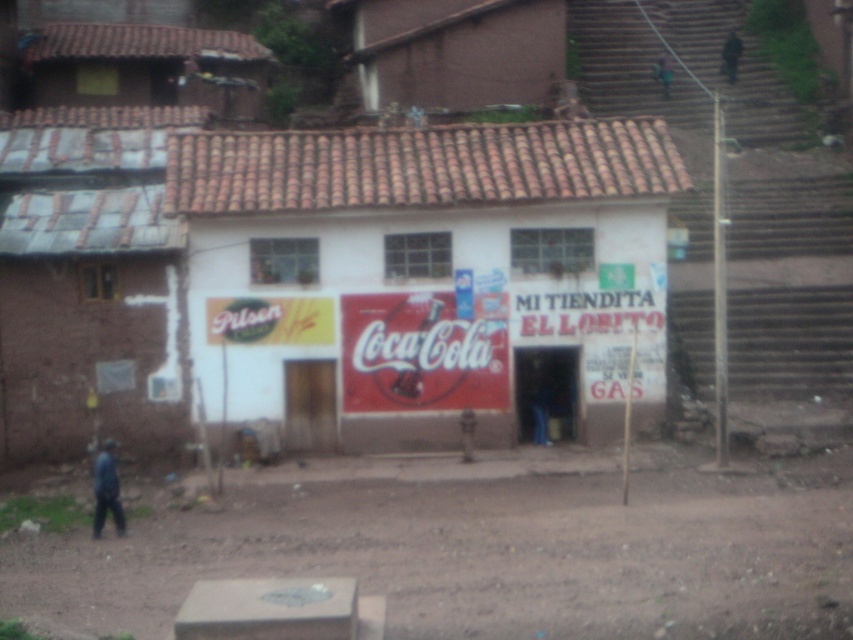
In the scene shown: Measure the distance between white painted wall at center and dark blue fabric at lower left.

A distance of 6.90 meters exists between white painted wall at center and dark blue fabric at lower left.

Is white painted wall at center behind dark blue fabric at lower left?

That is True.

Is point (664, 353) behind point (106, 497)?

Yes, it is behind point (106, 497).

The height and width of the screenshot is (640, 853). In order to click on white painted wall at center in this screenshot , I will do `click(422, 273)`.

Does white painted wall at center have a larger size compared to brown dirt field at lower center?

Yes.

The height and width of the screenshot is (640, 853). Describe the element at coordinates (422, 273) in the screenshot. I see `white painted wall at center` at that location.

Locate an element on the screen. Image resolution: width=853 pixels, height=640 pixels. white painted wall at center is located at coordinates (422, 273).

You are a GUI agent. You are given a task and a screenshot of the screen. Output one action in this format:
    pyautogui.click(x=<x>, y=<y>)
    Task: Click on the white painted wall at center
    
    Given the screenshot: What is the action you would take?
    tap(422, 273)

Who is lower down, brown dirt field at lower center or dark blue fabric at lower left?

brown dirt field at lower center

Does brown dirt field at lower center have a smaller size compared to dark blue fabric at lower left?

No, brown dirt field at lower center is not smaller than dark blue fabric at lower left.

The height and width of the screenshot is (640, 853). Describe the element at coordinates (489, 554) in the screenshot. I see `brown dirt field at lower center` at that location.

Image resolution: width=853 pixels, height=640 pixels. What are the coordinates of `brown dirt field at lower center` in the screenshot? It's located at (489, 554).